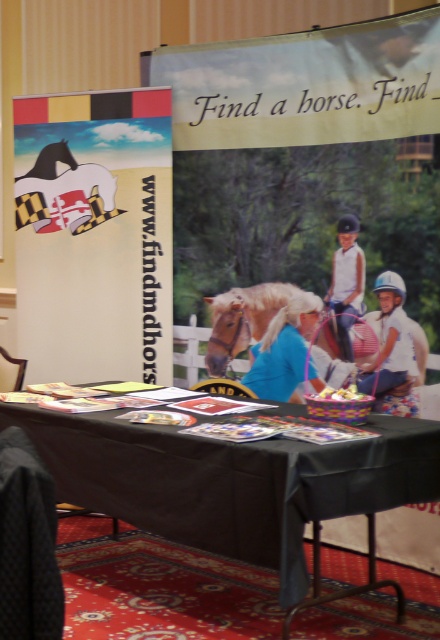
Question: Does black fabric table at center appear on the right side of white cotton shirt at center?

Choices:
 (A) yes
 (B) no

Answer: (B)

Question: Which object is the closest to the light blue fabric at center?

Choices:
 (A) white helmet at center
 (B) blonde mane horse at center
 (C) white cotton shirt at center
 (D) black fabric table at center

Answer: (B)

Question: Among these objects, which one is nearest to the camera?

Choices:
 (A) white cotton shirt at center
 (B) white helmet at center
 (C) black fabric table at center

Answer: (C)

Question: Is white cotton shirt at center below blonde mane horse at center?

Choices:
 (A) no
 (B) yes

Answer: (A)

Question: Considering the real-world distances, which object is farthest from the light blue fabric at center?

Choices:
 (A) blonde mane horse at center
 (B) black fabric table at center
 (C) white cotton shirt at center
 (D) white helmet at center

Answer: (B)

Question: Is white cotton shirt at center behind blonde mane horse at center?

Choices:
 (A) yes
 (B) no

Answer: (B)